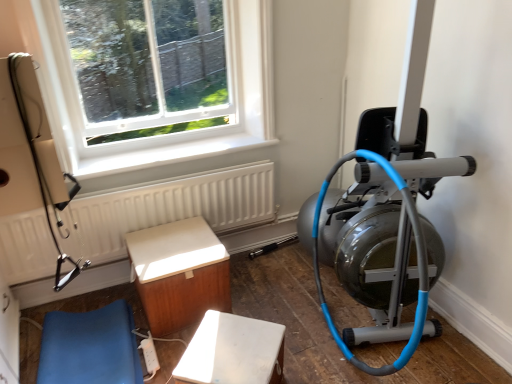
Image resolution: width=512 pixels, height=384 pixels. I want to click on blank space situated above wooden cabinet at lower left, which ranks as the second furniture in left-to-right order (from a real-world perspective), so click(x=170, y=250).